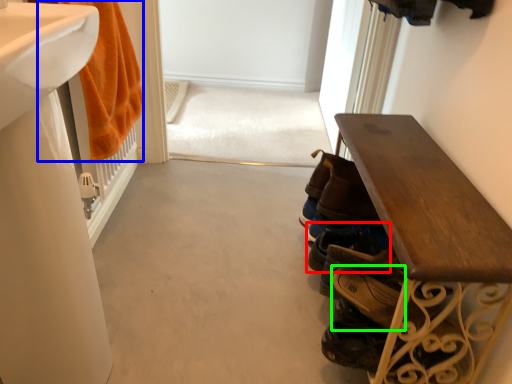
Question: Which object is the closest to the footwear (highlighted by a red box)? Choose among these: bath towel (highlighted by a blue box) or shoe (highlighted by a green box).

Choices:
 (A) bath towel
 (B) shoe

Answer: (B)